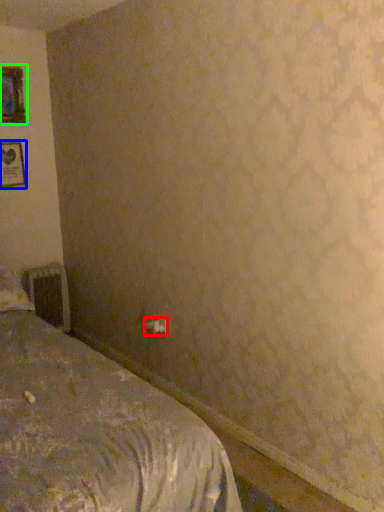
Question: Which object is positioned farthest from electric outlet (highlighted by a red box)? Select from picture frame (highlighted by a blue box) and picture frame (highlighted by a green box).

Choices:
 (A) picture frame
 (B) picture frame

Answer: (B)